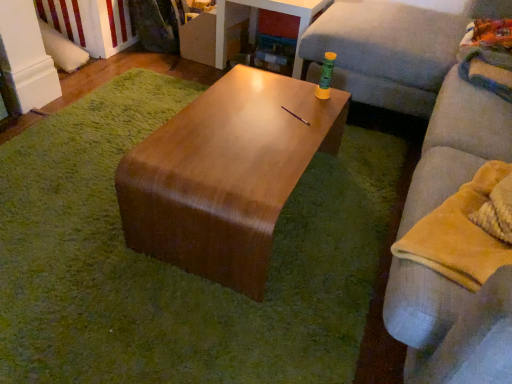
Identify the location of free location above wooden table at center (from a real-world perspective). The image size is (512, 384). (114, 196).